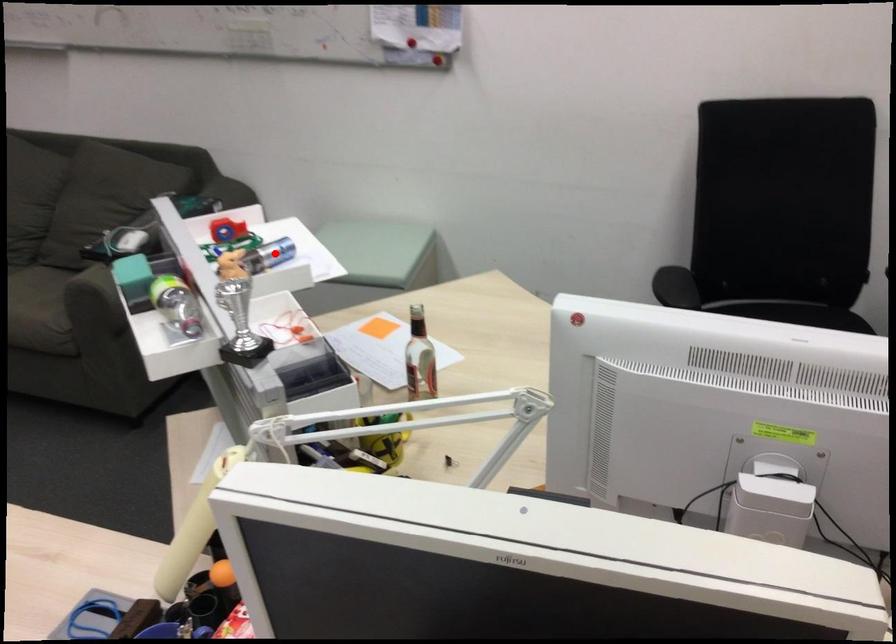
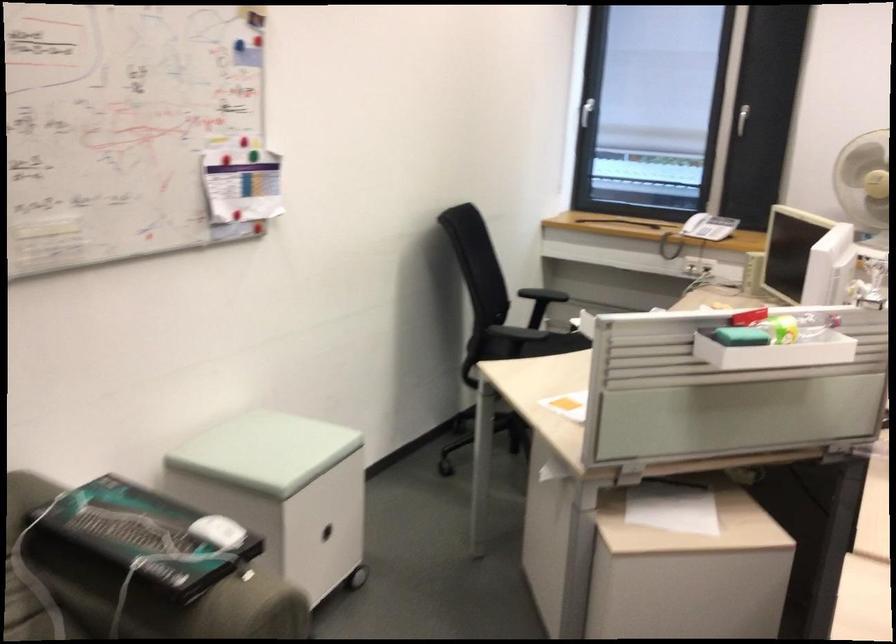
Question: I am providing you with two images of the same scene from different viewpoints. A red point is marked on the first image. Can you still see the location of the red point in image 2?

Choices:
 (A) Yes
 (B) No

Answer: (B)